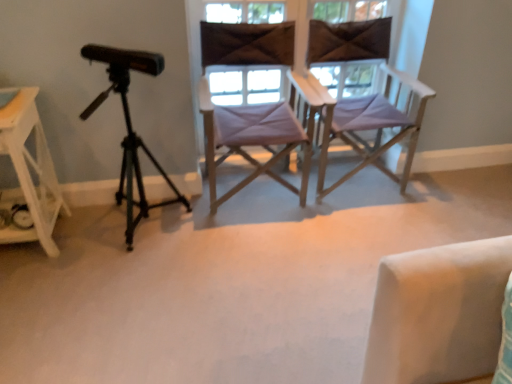
The height and width of the screenshot is (384, 512). Find the location of `vacant area that lies in front of black matte tripod at left`. vacant area that lies in front of black matte tripod at left is located at coordinates (135, 279).